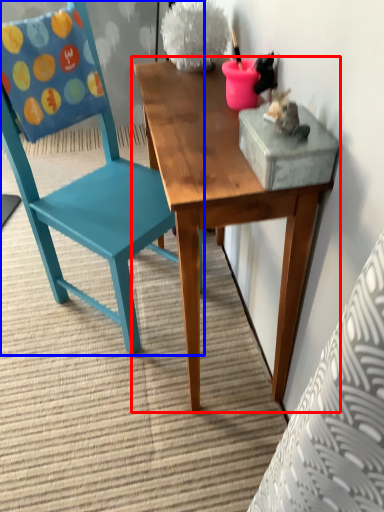
Question: Which point is closer to the camera, table (highlighted by a red box) or chair (highlighted by a blue box)?

Choices:
 (A) table
 (B) chair

Answer: (A)